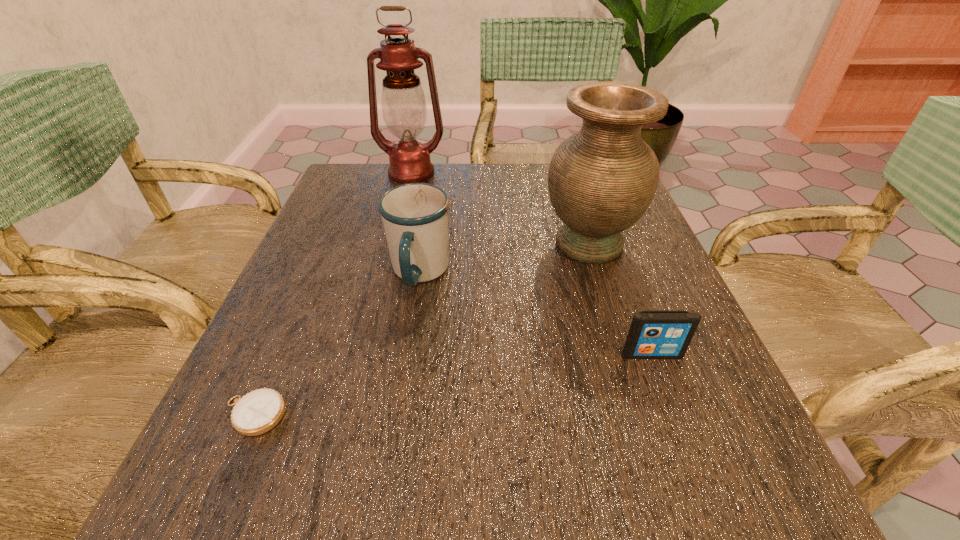
This screenshot has height=540, width=960. Find the location of `the tallest object`. the tallest object is located at coordinates (404, 108).

Locate an element on the screen. the farthest object is located at coordinates (404, 108).

In order to click on the fourth shortest object in this screenshot , I will do `click(601, 180)`.

Image resolution: width=960 pixels, height=540 pixels. What are the coordinates of `the third tallest object` in the screenshot? It's located at (415, 216).

This screenshot has height=540, width=960. Identify the location of iPod. (653, 334).

Where is `the second shortest object`? The height and width of the screenshot is (540, 960). the second shortest object is located at coordinates (653, 334).

Locate an element on the screen. the leftmost object is located at coordinates (257, 412).

Locate an element on the screen. The image size is (960, 540). the shortest object is located at coordinates (257, 412).

The image size is (960, 540). In order to click on vacant space located on the right of the farthest object in this screenshot , I will do `click(465, 173)`.

Locate an element on the screen. The width and height of the screenshot is (960, 540). free space located on the front of the vase is located at coordinates (626, 361).